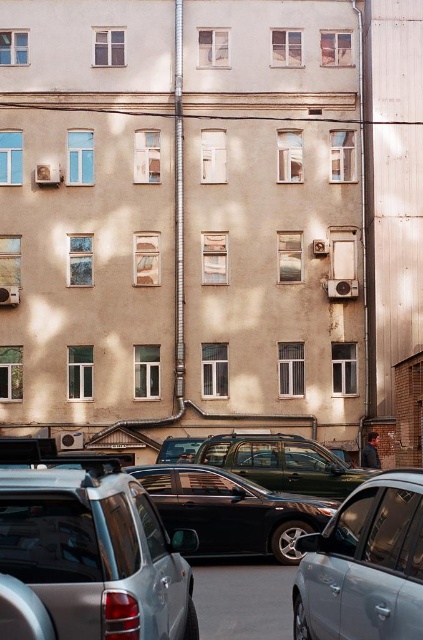
Question: Among these points, which one is farthest from the camera?

Choices:
 (A) (178, 541)
 (B) (208, 436)

Answer: (B)

Question: Estimate the real-world distances between objects in this image. Which object is closer to the metallic green suv at center?

Choices:
 (A) black plastic license plate at center
 (B) satin silver car at center
 (C) shiny black sedan at center
 (D) metallic gray sedan at center

Answer: (C)

Question: Considering the relative positions of satin silver car at center and metallic green suv at center in the image provided, where is satin silver car at center located with respect to metallic green suv at center?

Choices:
 (A) left
 (B) right

Answer: (A)

Question: Where is satin silver car at center located in relation to metallic gray sedan at center in the image?

Choices:
 (A) left
 (B) right

Answer: (A)

Question: Is shiny black sedan at center above black plastic license plate at center?

Choices:
 (A) yes
 (B) no

Answer: (B)

Question: Which object appears farthest from the camera in this image?

Choices:
 (A) black plastic license plate at center
 (B) metallic gray sedan at center
 (C) shiny black sedan at center
 (D) metallic green suv at center

Answer: (D)